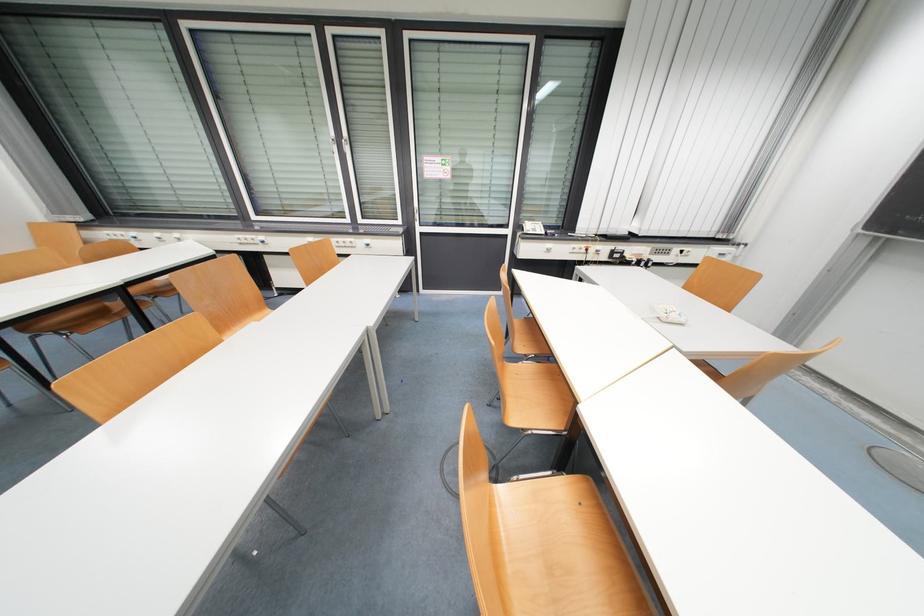
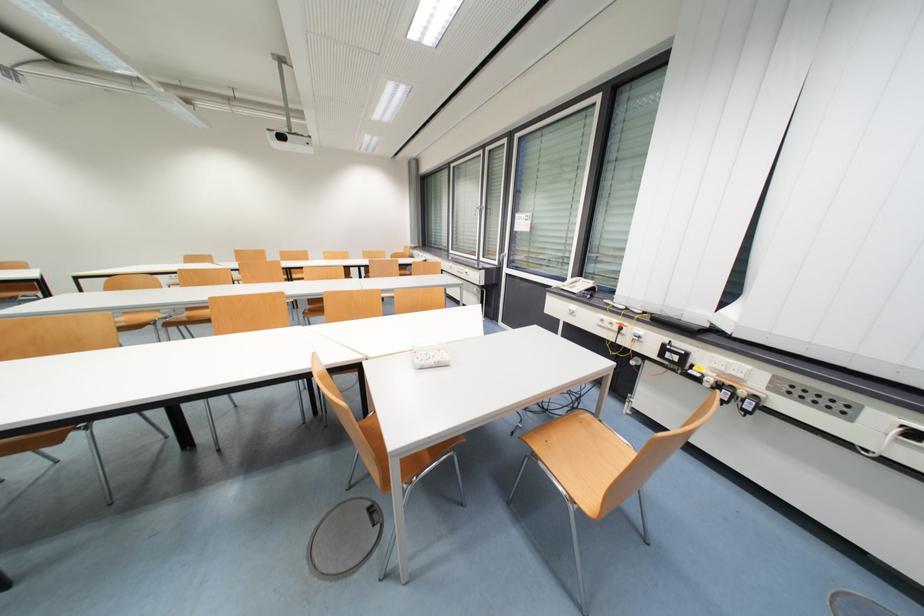
Question: I am providing you with two images of the same scene from different viewpoints. Which of the following objects are not visible in image2?

Choices:
 (A) white power switch
 (B) silver window handle
 (C) small white box
 (D) none of these

Answer: (D)